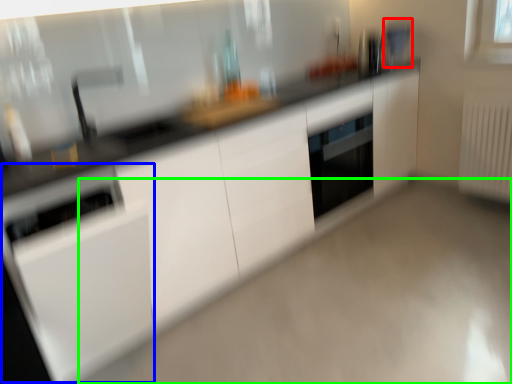
Question: Considering the real-world distances, which object is closest to appliance (highlighted by a red box)? appliance (highlighted by a blue box) or plain (highlighted by a green box).

Choices:
 (A) appliance
 (B) plain

Answer: (B)